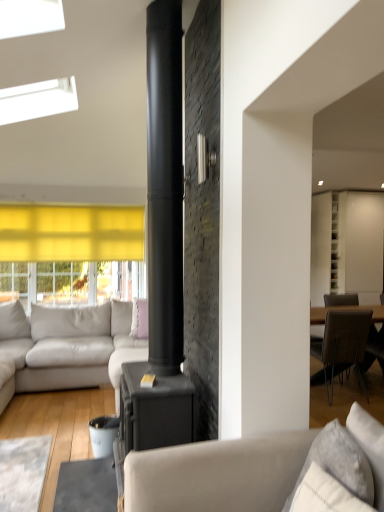
Question: Can you confirm if pink fabric pillow at center, which is the first pillow from back to front, is bigger than white glossy cabinet at upper right?

Choices:
 (A) yes
 (B) no

Answer: (B)

Question: Does pink fabric pillow at center, which is the 1th pillow from left to right, turn towards white glossy cabinet at upper right?

Choices:
 (A) no
 (B) yes

Answer: (A)

Question: Is pink fabric pillow at center, which is the first pillow from back to front, located outside white glossy cabinet at upper right?

Choices:
 (A) yes
 (B) no

Answer: (A)

Question: From a real-world perspective, is pink fabric pillow at center, which is the first pillow from back to front, positioned over white glossy cabinet at upper right based on gravity?

Choices:
 (A) yes
 (B) no

Answer: (B)

Question: Does pink fabric pillow at center, which is the first pillow from back to front, have a lesser width compared to white glossy cabinet at upper right?

Choices:
 (A) yes
 (B) no

Answer: (A)

Question: Considering the relative positions of white textured pillow at lower right, arranged as the 1th pillow when viewed from the right, and light gray leather couch at left, the second studio couch viewed from the right, in the image provided, is white textured pillow at lower right, arranged as the 1th pillow when viewed from the right, to the left or to the right of light gray leather couch at left, the second studio couch viewed from the right,?

Choices:
 (A) right
 (B) left

Answer: (A)

Question: Relative to light gray leather couch at left, which is the 2th studio couch in front-to-back order, is white textured pillow at lower right, arranged as the 1th pillow when viewed from the right, in front or behind?

Choices:
 (A) behind
 (B) front

Answer: (B)

Question: From a real-world perspective, is white textured pillow at lower right, arranged as the 1th pillow when viewed from the right, positioned above or below light gray leather couch at left, marked as the 1th studio couch in a back-to-front arrangement?

Choices:
 (A) below
 (B) above

Answer: (B)

Question: Is white textured pillow at lower right, the first pillow positioned from the front, wider or thinner than light gray leather couch at left, the second studio couch viewed from the right?

Choices:
 (A) wide
 (B) thin

Answer: (B)

Question: From the image's perspective, is pink fabric pillow at center, the 2th pillow in the front-to-back sequence, above or below white textured pillow at lower right, arranged as the 1th pillow when viewed from the right?

Choices:
 (A) below
 (B) above

Answer: (B)

Question: Do you think pink fabric pillow at center, which is the first pillow from back to front, is within white textured pillow at lower right, the first pillow positioned from the front, or outside of it?

Choices:
 (A) outside
 (B) inside

Answer: (A)

Question: Is pink fabric pillow at center, which is the first pillow from back to front, wider or thinner than white textured pillow at lower right, the 2th pillow positioned from the left?

Choices:
 (A) wide
 (B) thin

Answer: (B)

Question: Considering the positions of pink fabric pillow at center, which is the 1th pillow from left to right, and white textured pillow at lower right, the 2th pillow positioned from the left, in the image, is pink fabric pillow at center, which is the 1th pillow from left to right, taller or shorter than white textured pillow at lower right, the 2th pillow positioned from the left,?

Choices:
 (A) short
 (B) tall

Answer: (B)

Question: From the image's perspective, is light gray leather couch at left, marked as the 1th studio couch in a back-to-front arrangement, located above or below brown textured chair at right?

Choices:
 (A) above
 (B) below

Answer: (A)

Question: Is point (105, 351) positioned closer to the camera than point (334, 344)?

Choices:
 (A) closer
 (B) farther

Answer: (B)